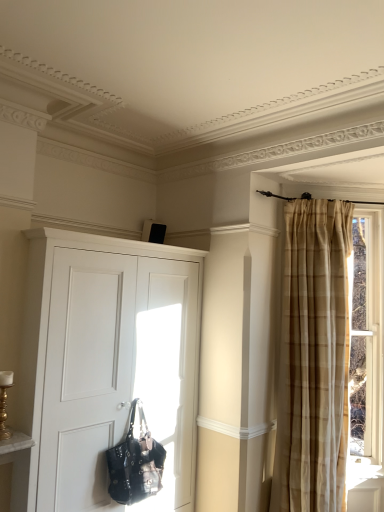
What are the coordinates of `white matte cupboard at center` in the screenshot? It's located at (107, 362).

Describe the element at coordinates (135, 463) in the screenshot. Image resolution: width=384 pixels, height=512 pixels. I see `shiny black leather handbag at lower left` at that location.

Find the location of a particular element. The width and height of the screenshot is (384, 512). brown plaid curtain at right is located at coordinates (313, 357).

Is white matte cupboard at center beside brown plaid curtain at right?

No, white matte cupboard at center is not touching brown plaid curtain at right.

Considering the relative sizes of white matte cupboard at center and brown plaid curtain at right in the image provided, is white matte cupboard at center smaller than brown plaid curtain at right?

No, white matte cupboard at center is not smaller than brown plaid curtain at right.

Considering the positions of objects white matte cupboard at center and brown plaid curtain at right in the image provided, who is more to the left, white matte cupboard at center or brown plaid curtain at right?

white matte cupboard at center.

Locate an element on the screen. Image resolution: width=384 pixels, height=512 pixels. curtain behind the white matte cupboard at center is located at coordinates (313, 357).

From the picture: Is brown plaid curtain at right to the left or to the right of shiny black leather handbag at lower left in the image?

brown plaid curtain at right is positioned on shiny black leather handbag at lower left's right side.

Between brown plaid curtain at right and shiny black leather handbag at lower left, which one has less height?

shiny black leather handbag at lower left.

From a real-world perspective, is brown plaid curtain at right physically below shiny black leather handbag at lower left?

No, from a real-world perspective, brown plaid curtain at right is not below shiny black leather handbag at lower left.

In the scene shown: Is brown plaid curtain at right completely or partially outside of shiny black leather handbag at lower left?

brown plaid curtain at right lies outside shiny black leather handbag at lower left's area.

The height and width of the screenshot is (512, 384). In order to click on handbag on the right of the white matte cupboard at center in this screenshot , I will do `click(135, 463)`.

Considering the relative sizes of shiny black leather handbag at lower left and white matte cupboard at center in the image provided, is shiny black leather handbag at lower left wider than white matte cupboard at center?

No.

Is point (127, 499) more distant than point (96, 483)?

No, it is in front of (96, 483).

Which object is closer to the camera taking this photo, shiny black leather handbag at lower left or white matte cupboard at center?

white matte cupboard at center is more forward.

Considering the positions of objects shiny black leather handbag at lower left and brown plaid curtain at right in the image provided, who is behind, shiny black leather handbag at lower left or brown plaid curtain at right?

Positioned behind is brown plaid curtain at right.

From the image's perspective, is shiny black leather handbag at lower left located beneath brown plaid curtain at right?

Yes.

Where is `curtain located on the right of shiny black leather handbag at lower left`? Image resolution: width=384 pixels, height=512 pixels. curtain located on the right of shiny black leather handbag at lower left is located at coordinates (313, 357).

Is point (114, 490) closer to viewer compared to point (280, 481)?

That is True.

Can you tell me how much white matte cupboard at center and shiny black leather handbag at lower left differ in facing direction?

The facing directions of white matte cupboard at center and shiny black leather handbag at lower left are 0.00385 degrees apart.

Looking at this image, is white matte cupboard at center at the left side of shiny black leather handbag at lower left?

Yes.

The height and width of the screenshot is (512, 384). What are the coordinates of `handbag that appears on the right of white matte cupboard at center` in the screenshot? It's located at (135, 463).

Is white matte cupboard at center completely or partially outside of shiny black leather handbag at lower left?

Yes, white matte cupboard at center is outside of shiny black leather handbag at lower left.

Find the location of a particular element. The image size is (384, 512). curtain on the right of white matte cupboard at center is located at coordinates (313, 357).

Is brown plaid curtain at right bigger or smaller than white matte cupboard at center?

Clearly, brown plaid curtain at right is smaller in size than white matte cupboard at center.

From the image's perspective, which is below, brown plaid curtain at right or white matte cupboard at center?

From the image's view, white matte cupboard at center is below.

Which point is more forward, (322, 409) or (125, 389)?

The point (125, 389) is closer.

Locate an element on the screen. This screenshot has height=512, width=384. cupboard located on the left of brown plaid curtain at right is located at coordinates (107, 362).

Find the location of a particular element. curtain above the shiny black leather handbag at lower left (from the image's perspective) is located at coordinates (313, 357).

Which object lies nearer to the anchor point shiny black leather handbag at lower left, white matte cupboard at center or brown plaid curtain at right?

white matte cupboard at center lies closer to shiny black leather handbag at lower left than the other object.

When comparing their distances from brown plaid curtain at right, does shiny black leather handbag at lower left or white matte cupboard at center seem closer?

Result: Among the two, white matte cupboard at center is located nearer to brown plaid curtain at right.

From the image, which object appears to be farther from white matte cupboard at center, shiny black leather handbag at lower left or brown plaid curtain at right?

Among the two, brown plaid curtain at right is located further to white matte cupboard at center.

Looking at the image, which one is located closer to white matte cupboard at center, brown plaid curtain at right or shiny black leather handbag at lower left?

shiny black leather handbag at lower left lies closer to white matte cupboard at center than the other object.

Which object lies nearer to the anchor point brown plaid curtain at right, white matte cupboard at center or shiny black leather handbag at lower left?

white matte cupboard at center.

When comparing their distances from shiny black leather handbag at lower left, does brown plaid curtain at right or white matte cupboard at center seem further?

brown plaid curtain at right is positioned further to the anchor shiny black leather handbag at lower left.

Find the location of a particular element. handbag between white matte cupboard at center and brown plaid curtain at right is located at coordinates (135, 463).